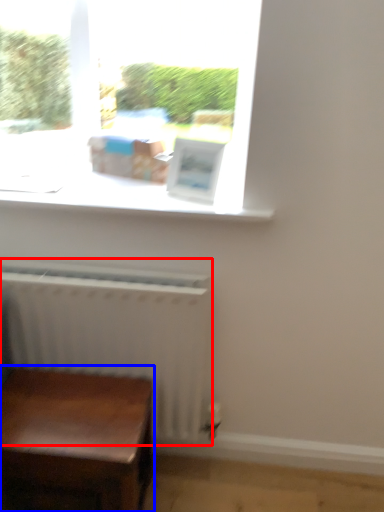
Question: Which object is further to the camera taking this photo, radiator (highlighted by a red box) or table (highlighted by a blue box)?

Choices:
 (A) radiator
 (B) table

Answer: (A)